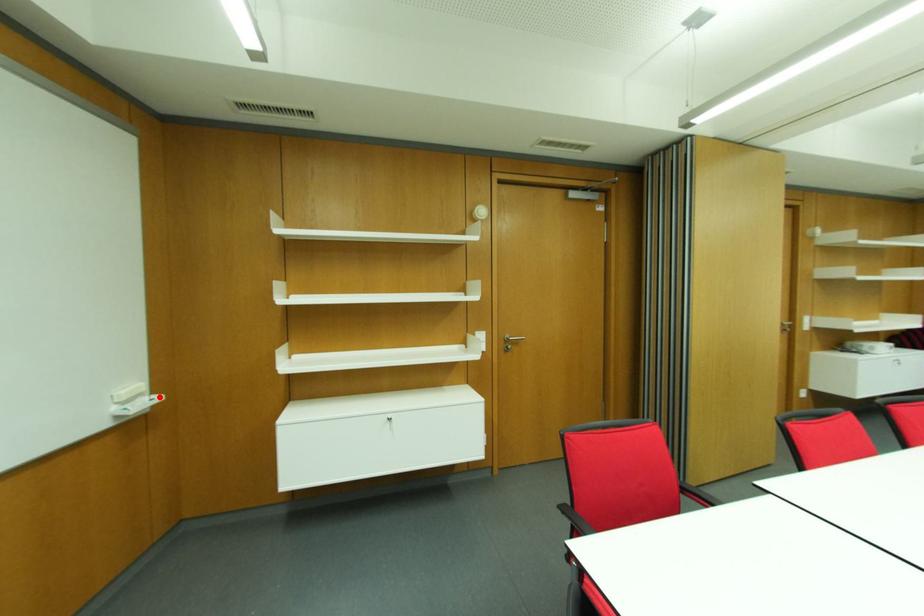
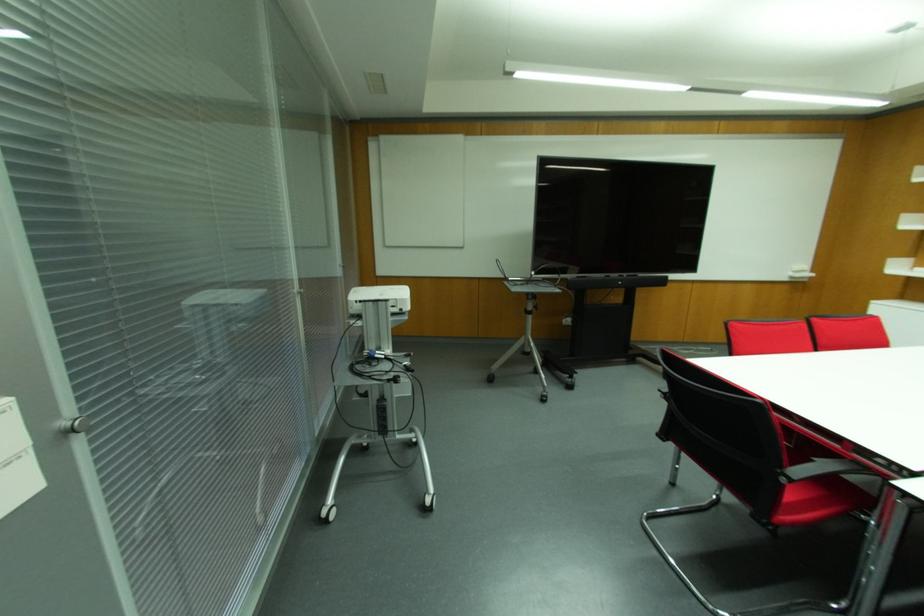
Question: I am providing you with two images of the same scene from different viewpoints. A red point is marked on the first image. Is the red point's position out of view in image 2?

Choices:
 (A) Yes
 (B) No

Answer: (B)